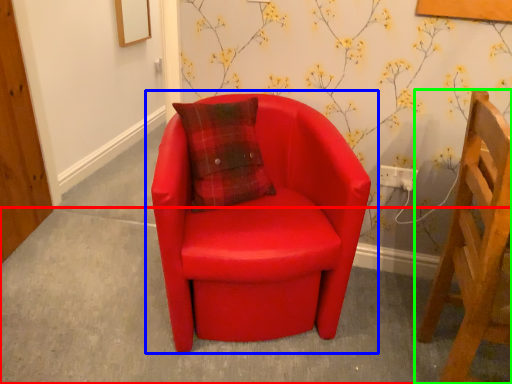
Question: Based on their relative distances, which object is farther from concrete (highlighted by a red box)? Choose from chair (highlighted by a blue box) and chair (highlighted by a green box).

Choices:
 (A) chair
 (B) chair

Answer: (B)